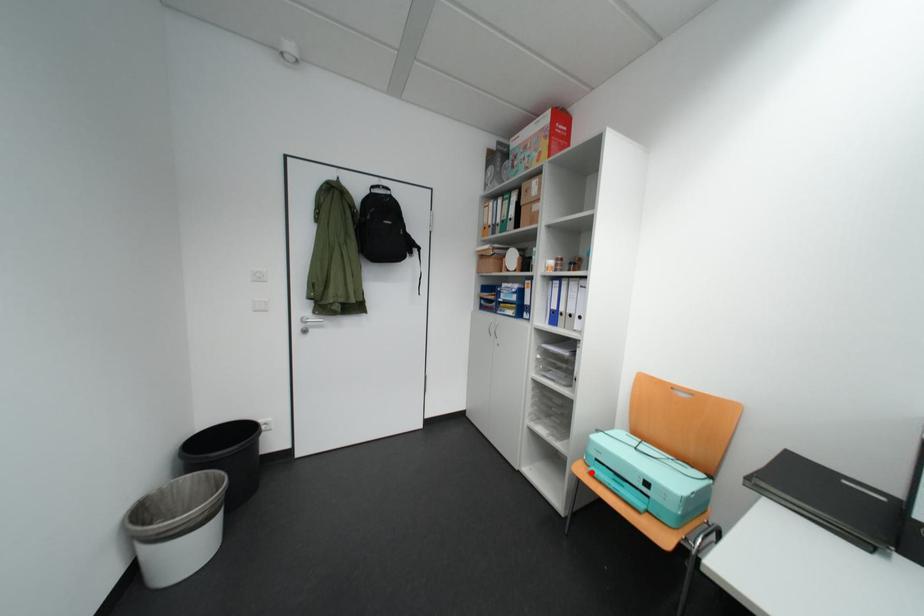
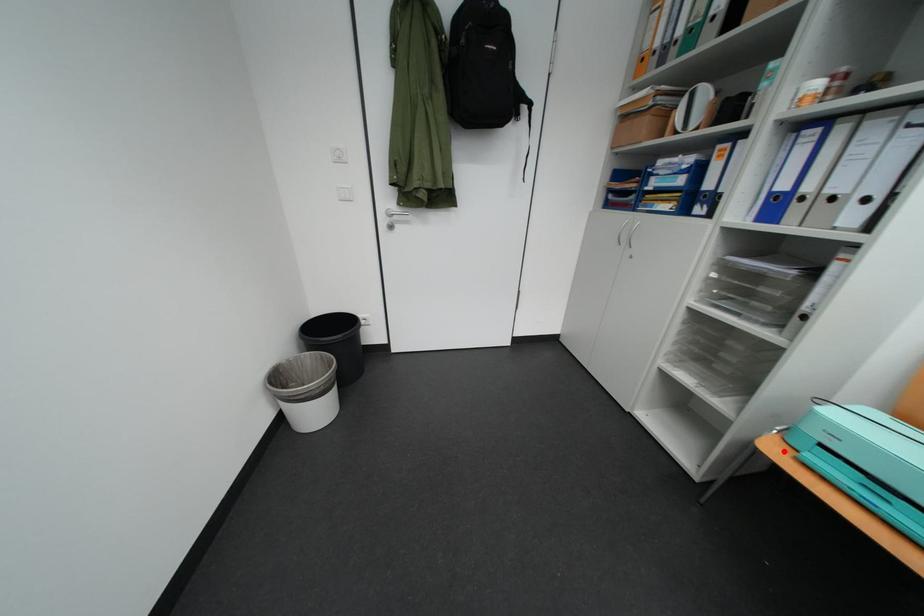
I am providing you with two images of the same scene from different viewpoints. A red point is marked on the first image and another point is marked on the second image. Is the marked point in image1 the same physical position as the marked point in image2?

Yes